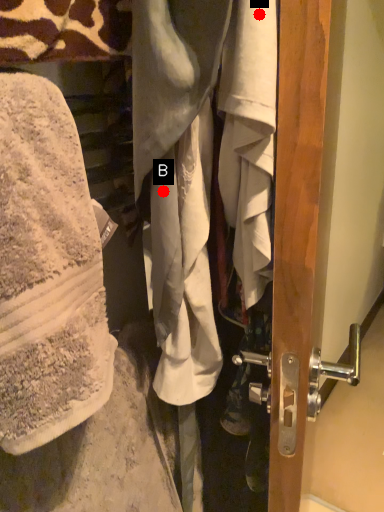
Question: Two points are circled on the image, labeled by A and B beside each circle. Which of the following is the farthest from the observer?

Choices:
 (A) A is further
 (B) B is further

Answer: (B)